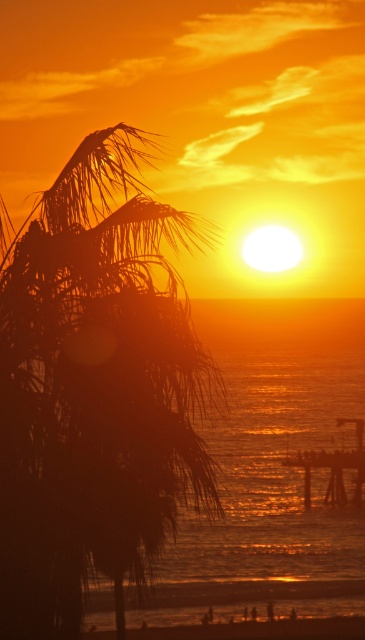
You are a photographer trying to capture the sunset. You notice the silhouette leafy palm at left and the glistening metallic water at center. Which object is positioned higher in the image?

The silhouette leafy palm at left is positioned higher in the image than the glistening metallic water at center.

Looking at this image, you are standing at the beach and see two points in the sunset scene. The first point is at position point (x=77, y=568) and the second is at point (x=324, y=467). Which point is closer to you?

Point (x=77, y=568) is in front of point (x=324, y=467), so it is closer to you.